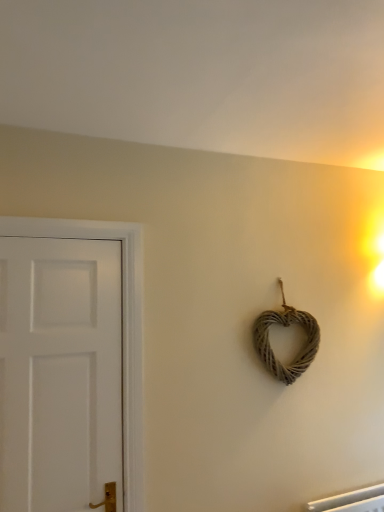
Question: Looking at their shapes, would you say white matte door at left is wider or thinner than woven natural heart at center-right?

Choices:
 (A) thin
 (B) wide

Answer: (A)

Question: Based on their sizes in the image, would you say white matte door at left is bigger or smaller than woven natural heart at center-right?

Choices:
 (A) small
 (B) big

Answer: (B)

Question: Does point (74, 248) appear closer or farther from the camera than point (286, 305)?

Choices:
 (A) farther
 (B) closer

Answer: (B)

Question: Considering their positions, is woven natural heart at center-right located in front of or behind white matte door at left?

Choices:
 (A) behind
 (B) front

Answer: (A)

Question: Is point (291, 366) closer or farther from the camera than point (54, 362)?

Choices:
 (A) farther
 (B) closer

Answer: (A)

Question: From a real-world perspective, is woven natural heart at center-right physically located above or below white matte door at left?

Choices:
 (A) above
 (B) below

Answer: (A)

Question: From their relative heights in the image, would you say woven natural heart at center-right is taller or shorter than white matte door at left?

Choices:
 (A) tall
 (B) short

Answer: (B)